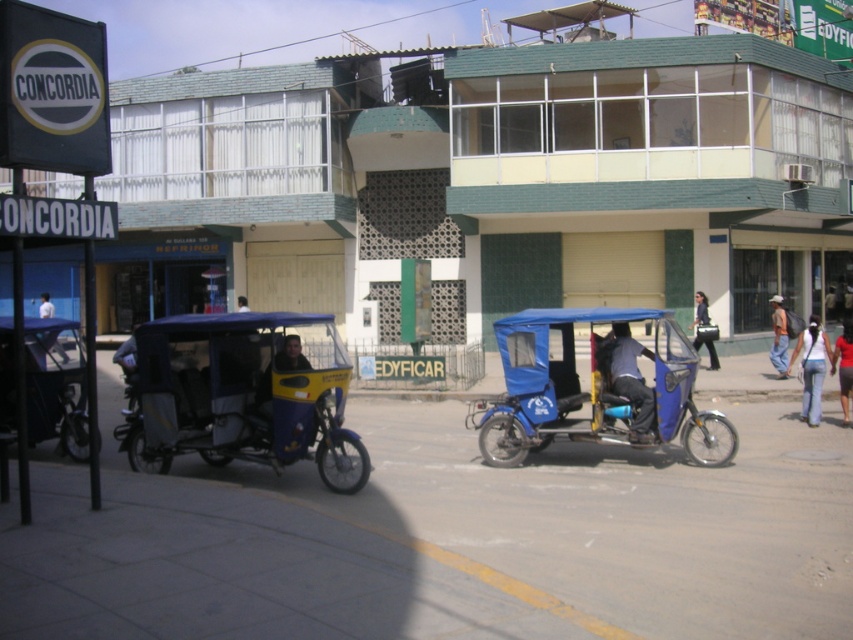
Between white cotton shirt at lower right and red fabric shirt at center, which one has more height?

red fabric shirt at center

Can you confirm if white cotton shirt at lower right is bigger than red fabric shirt at center?

No, white cotton shirt at lower right is not bigger than red fabric shirt at center.

Is point (788, 368) in front of point (834, 342)?

Yes, it is.

Where is `white cotton shirt at lower right`? This screenshot has width=853, height=640. white cotton shirt at lower right is located at coordinates (811, 368).

Is yellow matte taxi at center further to camera compared to dark blue fabric tuk-tuk at center?

No, yellow matte taxi at center is closer to the viewer.

Is point (264, 372) in front of point (247, 307)?

That is True.

Between point (270, 397) and point (242, 298), which one is positioned behind?

The point (242, 298) is behind.

The image size is (853, 640). Find the location of `yellow matte taxi at center`. yellow matte taxi at center is located at coordinates (289, 355).

Is point (780, 344) farther from viewer compared to point (695, 291)?

No.

Image resolution: width=853 pixels, height=640 pixels. I want to click on brown fabric backpack at right, so click(778, 337).